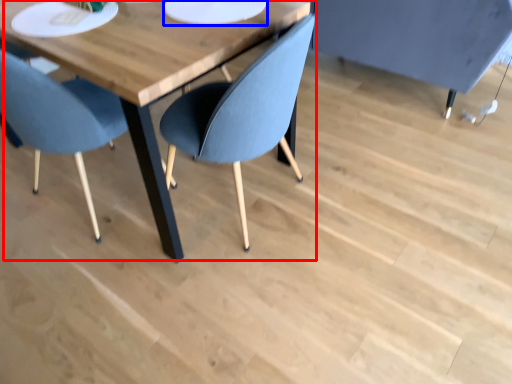
Question: Which object appears farthest to the camera in this image, table (highlighted by a red box) or paper plate (highlighted by a blue box)?

Choices:
 (A) table
 (B) paper plate

Answer: (B)